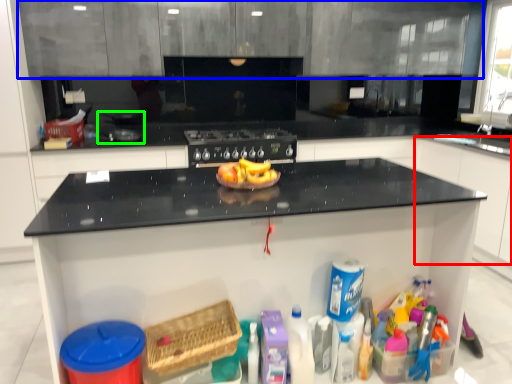
Question: Estimate the real-world distances between objects in this image. Which object is farther from cabinetry (highlighted by a red box), cabinetry (highlighted by a blue box) or appliance (highlighted by a green box)?

Choices:
 (A) cabinetry
 (B) appliance

Answer: (B)